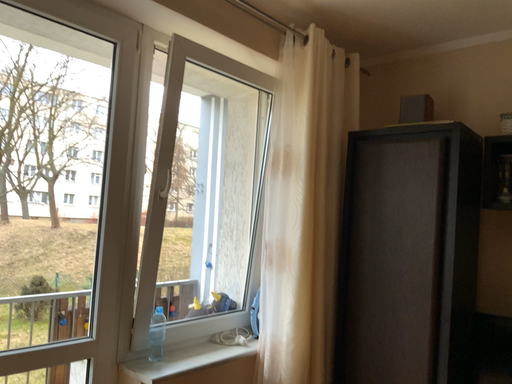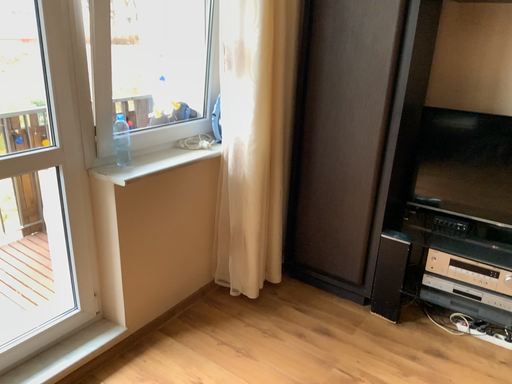
Question: Which way did the camera rotate in the video?

Choices:
 (A) rotated left
 (B) rotated right

Answer: (B)